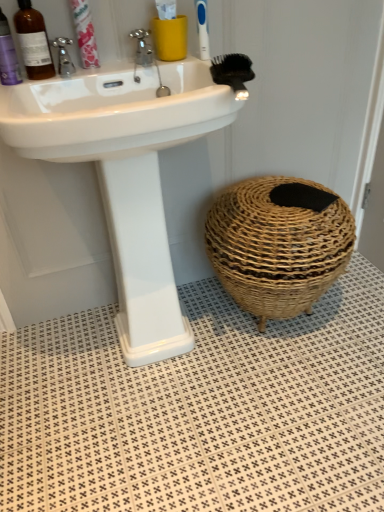
Where is `vacant space that is to the left of metallic chrome faucet at upper center, the 2th tap viewed from the left`? This screenshot has width=384, height=512. vacant space that is to the left of metallic chrome faucet at upper center, the 2th tap viewed from the left is located at coordinates (108, 70).